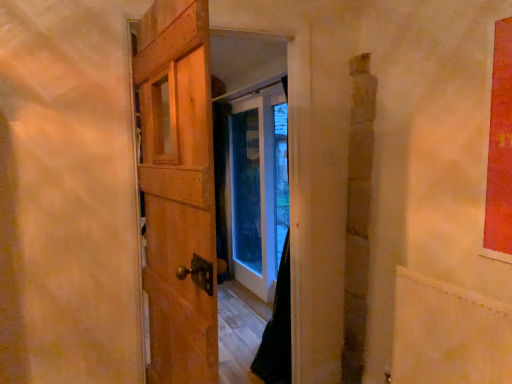
Question: From a real-world perspective, is smooth beige plywood at lower right on top of wooden door at center?

Choices:
 (A) yes
 (B) no

Answer: (B)

Question: Is smooth beige plywood at lower right wider than wooden door at center?

Choices:
 (A) yes
 (B) no

Answer: (B)

Question: Is smooth beige plywood at lower right placed right next to wooden door at center?

Choices:
 (A) yes
 (B) no

Answer: (B)

Question: Is wooden door at center at the back of smooth beige plywood at lower right?

Choices:
 (A) no
 (B) yes

Answer: (A)

Question: Is smooth beige plywood at lower right behind wooden door at center?

Choices:
 (A) yes
 (B) no

Answer: (A)

Question: Considering the relative sizes of smooth beige plywood at lower right and wooden door at center in the image provided, is smooth beige plywood at lower right smaller than wooden door at center?

Choices:
 (A) yes
 (B) no

Answer: (A)

Question: Is wooden door at center bigger than smooth beige plywood at lower right?

Choices:
 (A) yes
 (B) no

Answer: (A)

Question: Does wooden door at center have a lesser width compared to smooth beige plywood at lower right?

Choices:
 (A) no
 (B) yes

Answer: (A)

Question: Considering the relative positions of wooden door at center and smooth beige plywood at lower right in the image provided, is wooden door at center to the right of smooth beige plywood at lower right from the viewer's perspective?

Choices:
 (A) no
 (B) yes

Answer: (A)

Question: From a real-world perspective, does wooden door at center stand above smooth beige plywood at lower right?

Choices:
 (A) no
 (B) yes

Answer: (B)

Question: Can we say wooden door at center lies outside smooth beige plywood at lower right?

Choices:
 (A) no
 (B) yes

Answer: (B)

Question: Considering the relative sizes of wooden door at center and smooth beige plywood at lower right in the image provided, is wooden door at center wider than smooth beige plywood at lower right?

Choices:
 (A) no
 (B) yes

Answer: (B)

Question: Looking at the image, does smooth beige plywood at lower right seem bigger or smaller compared to wooden door at center?

Choices:
 (A) big
 (B) small

Answer: (B)